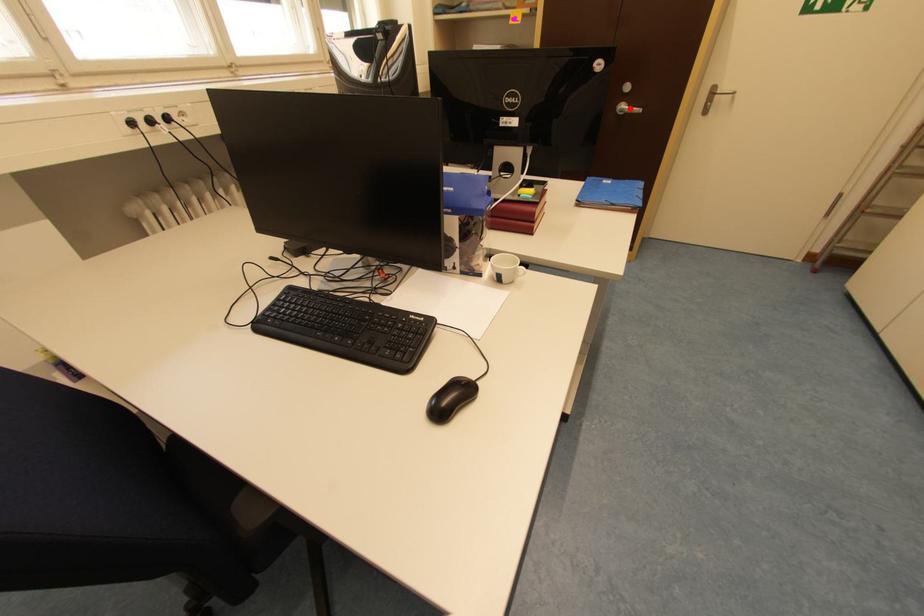
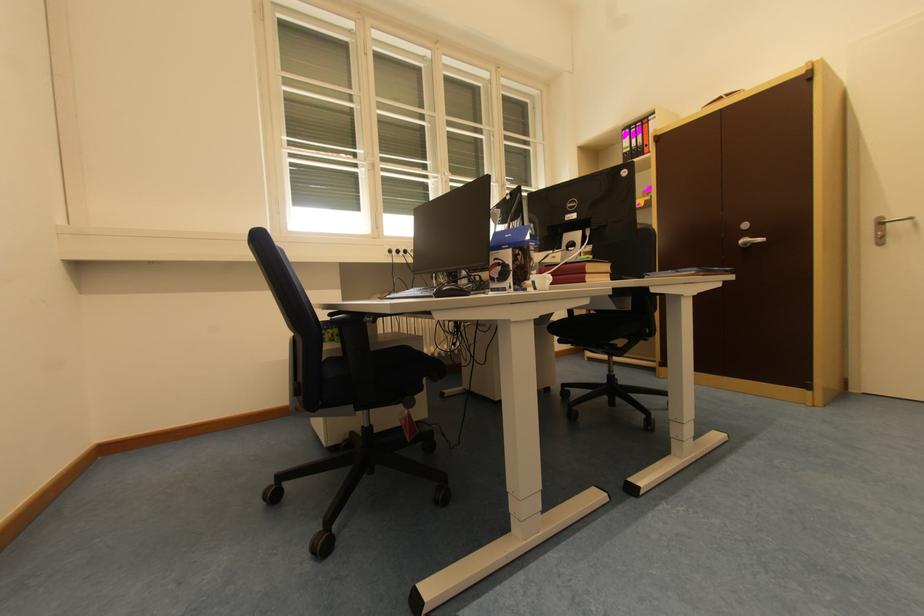
Find the pixel in the second image that matches the highlighted location in the first image.

(752, 241)